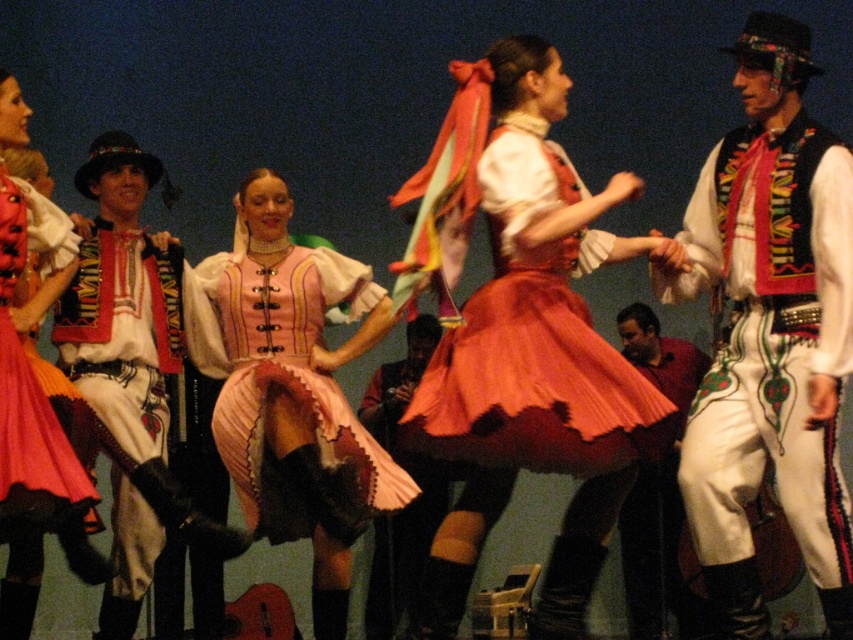
You are a photographer capturing the stage performance. You notice the white cotton shirt at left and the dark red fabric at center. Which one is positioned higher in the frame?

The white cotton shirt at left is located above the dark red fabric at center, so it is positioned higher in the frame.

You are a photographer in the audience taking pictures of the dancers. You notice the white satin vest at right and the dark red fabric at center. Which one appears larger in your photo?

The white satin vest at right appears larger in the photo because it is closer to the viewer than the dark red fabric at center.

You are a stagehand who needs to place a 1.5 meter long pole between the dark red fabric at center and the matte white pants at center. Can the pole fit between them without bending?

The dark red fabric at center and matte white pants at center are 1.71 meters apart from each other, so the 1.5 meter long pole can fit between them without bending since the distance is greater than the pole length.